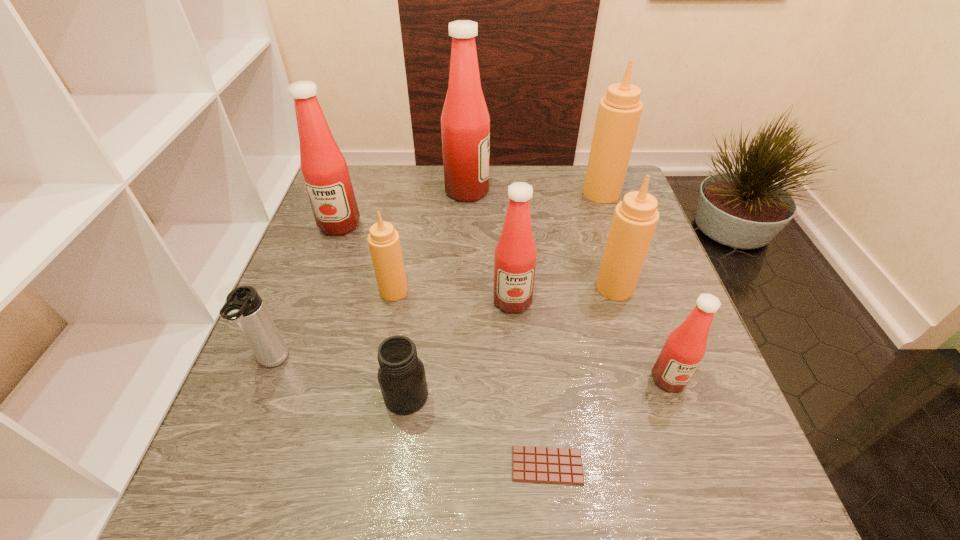
Locate an element on the screen. The height and width of the screenshot is (540, 960). the smallest red condiment is located at coordinates (685, 346).

At what (x,y) coordinates should I click in order to perform the action: click on the rightmost red condiment. Please return your answer as a coordinate pair (x, y). This screenshot has height=540, width=960. Looking at the image, I should click on (685, 346).

Locate an element on the screen. The height and width of the screenshot is (540, 960). thermos bottle is located at coordinates (244, 306).

This screenshot has width=960, height=540. Identify the location of jar. (401, 375).

This screenshot has height=540, width=960. I want to click on candy bar, so click(549, 465).

Where is `the shortest object`? the shortest object is located at coordinates (549, 465).

This screenshot has height=540, width=960. I want to click on vacant space located on the front-facing side of the farthest red condiment, so click(x=604, y=191).

Where is `blank space located 0.110m on the front-facing side of the fifth nearest condiment`? This screenshot has width=960, height=540. blank space located 0.110m on the front-facing side of the fifth nearest condiment is located at coordinates (324, 266).

Where is `vacant space positioned 0.120m on the front of the biggest tan condiment`? Image resolution: width=960 pixels, height=540 pixels. vacant space positioned 0.120m on the front of the biggest tan condiment is located at coordinates (614, 230).

Locate an element on the screen. The height and width of the screenshot is (540, 960). vacant space located on the back of the second smallest tan condiment is located at coordinates click(592, 214).